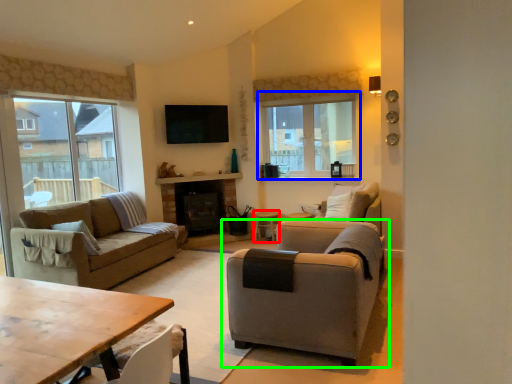
Question: Which object is positioned farthest from side table (highlighted by a red box)? Select from window (highlighted by a blue box) and chair (highlighted by a green box).

Choices:
 (A) window
 (B) chair

Answer: (B)